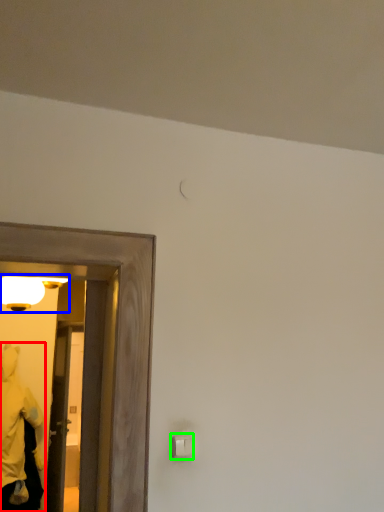
Question: Considering the real-world distances, which object is closest to person (highlighted by a red box)? light fixture (highlighted by a blue box) or light switch (highlighted by a green box).

Choices:
 (A) light fixture
 (B) light switch

Answer: (A)